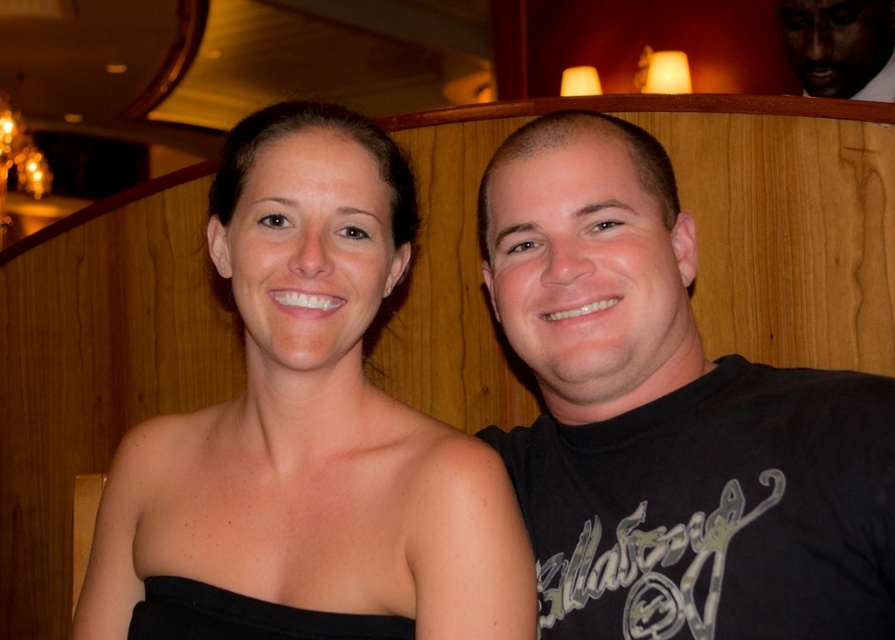
You are a photographer setting up a camera to capture this scene. You need to ensure that the black matte shirt at right and the dark skin smooth face at upper right are both in focus. Based on their positions, which object should you prioritize focusing on to ensure both are sharp?

The black matte shirt at right is wider than the dark skin smooth face at upper right, so focusing on the black matte shirt at right first would help ensure both are in focus since it has a larger surface area.

You are a photographer adjusting your camera settings to capture the scene. You need to focus on both the black matte dress at center and the dark skin smooth face at upper right. Which object should you prioritize focusing on first if you want to ensure the one with the larger size in the frame is sharp?

→ The black matte dress at center has a greater height compared to the dark skin smooth face at upper right, so you should prioritize focusing on the black matte dress at center first to ensure the larger object is sharp.

You are a photographer setting up for a portrait session. You need to ensure that the black matte dress at center and the dark skin smooth face at upper right are both in focus. Given that your camera has a depth of field that can cover objects within 6 feet of each other, will both subjects be in focus?

The distance between the black matte dress at center and the dark skin smooth face at upper right is 6.59 feet. Since the camera can only cover 6 feet, the two subjects are slightly out of the depth of field range. Therefore, both subjects may not be in focus simultaneously.